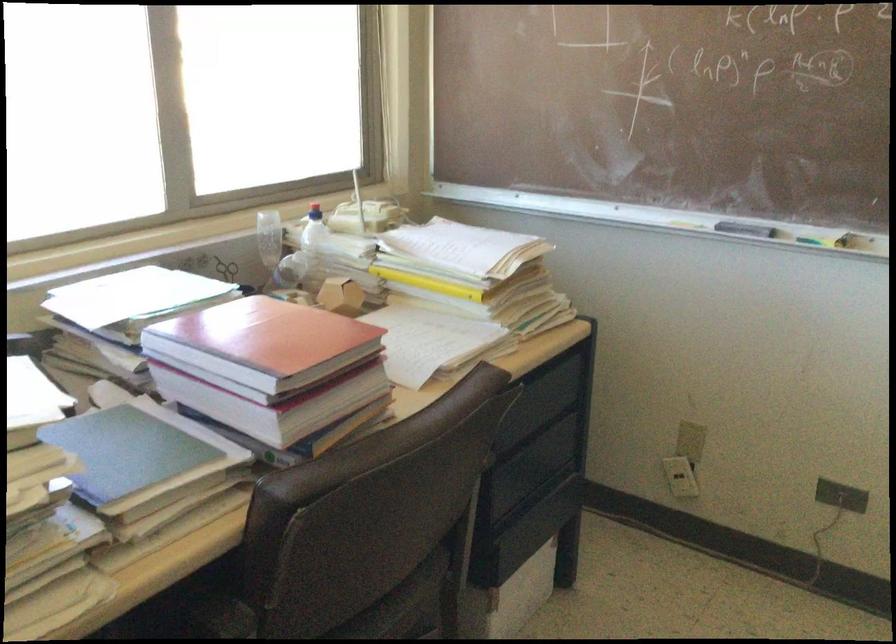
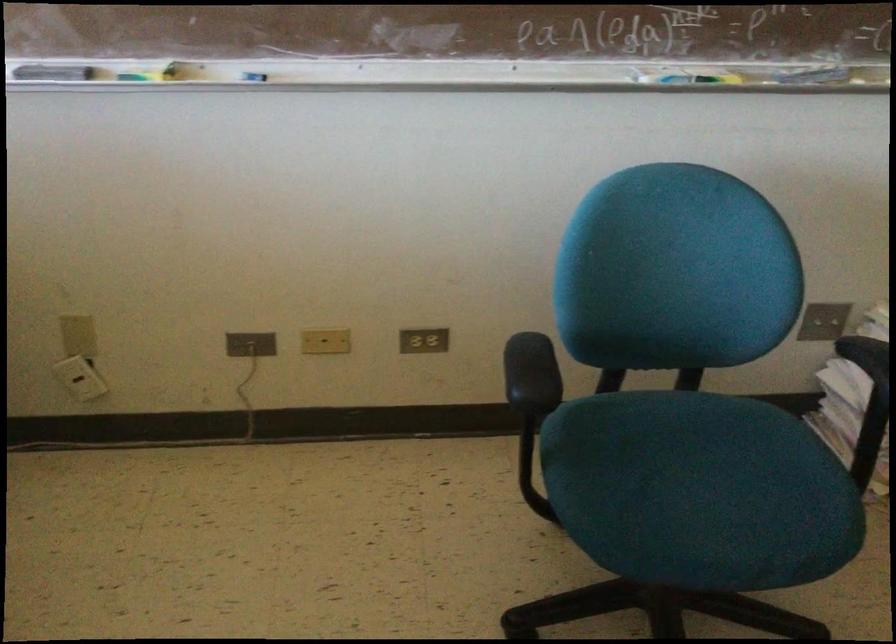
Find the pixel in the second image that matches (x=751, y=230) in the first image.

(53, 73)